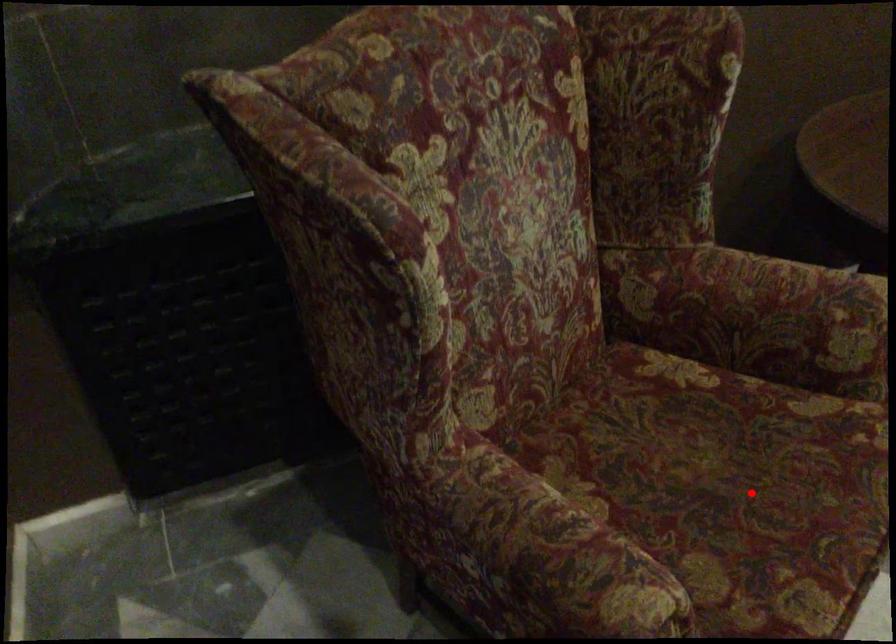
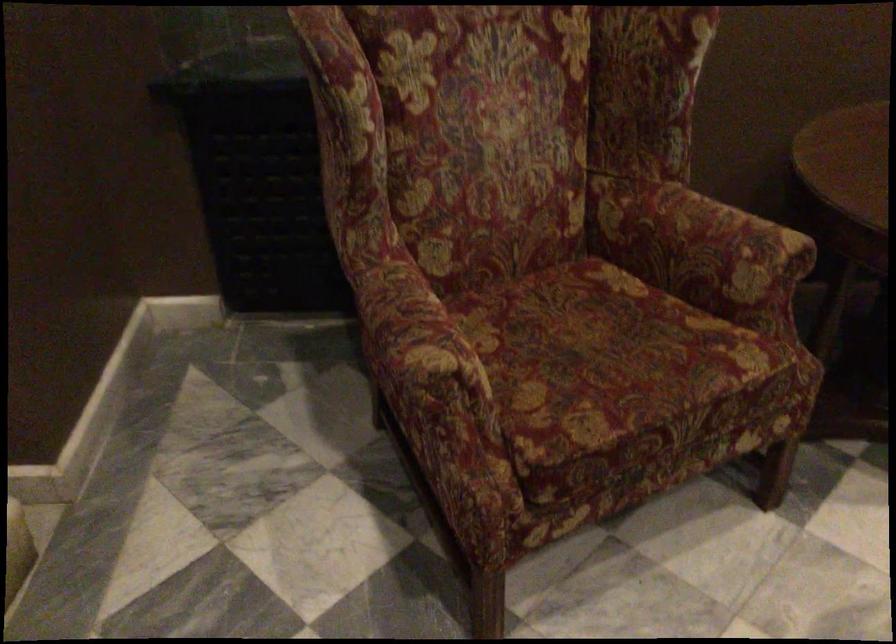
The point at the highlighted location is marked in the first image. Where is the corresponding point in the second image?

(606, 361)